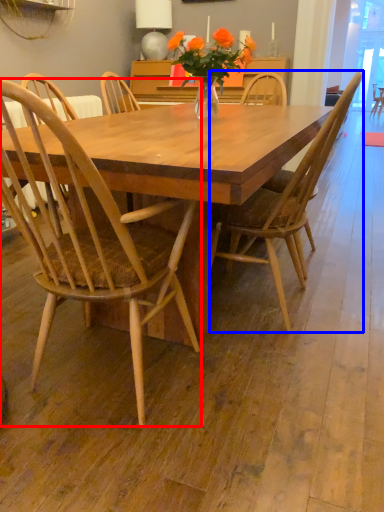
Question: Among these objects, which one is farthest to the camera, chair (highlighted by a red box) or chair (highlighted by a blue box)?

Choices:
 (A) chair
 (B) chair

Answer: (B)